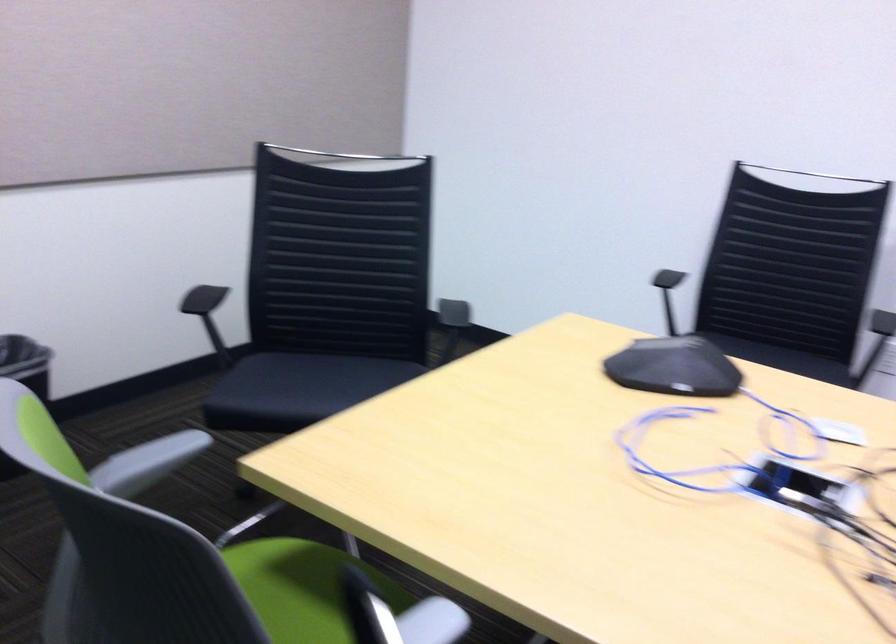
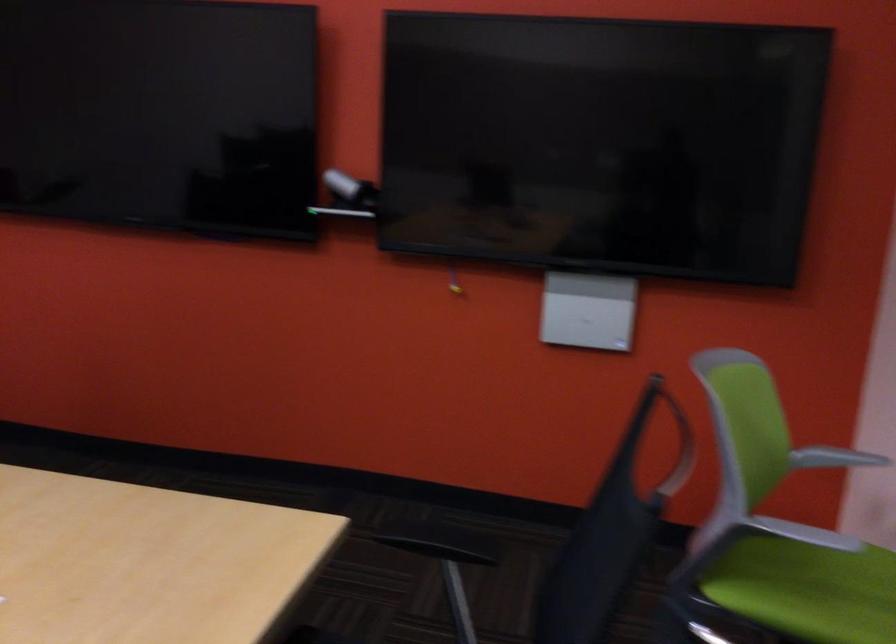
Based on the continuous images, in which direction is the camera rotating?

The rotation direction of the camera is right-down.